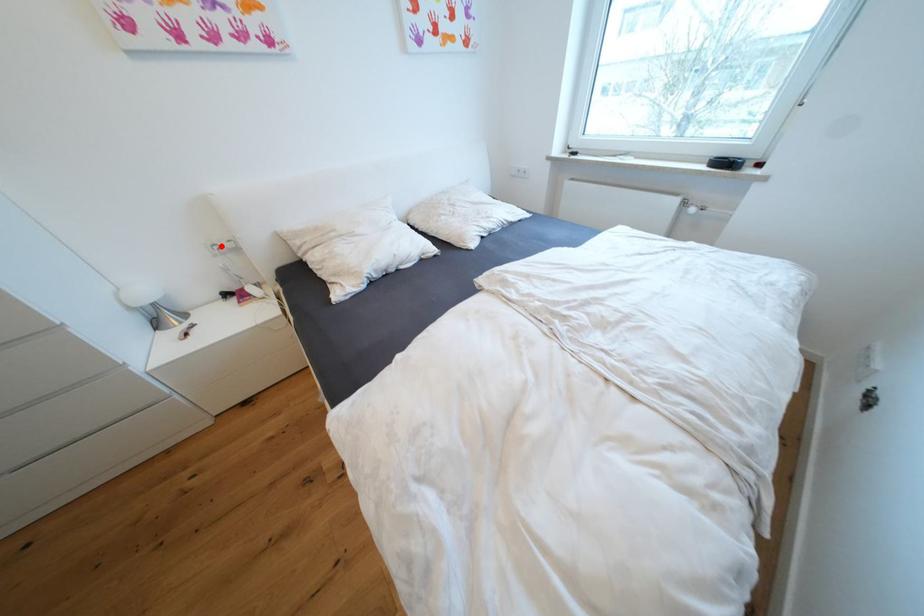
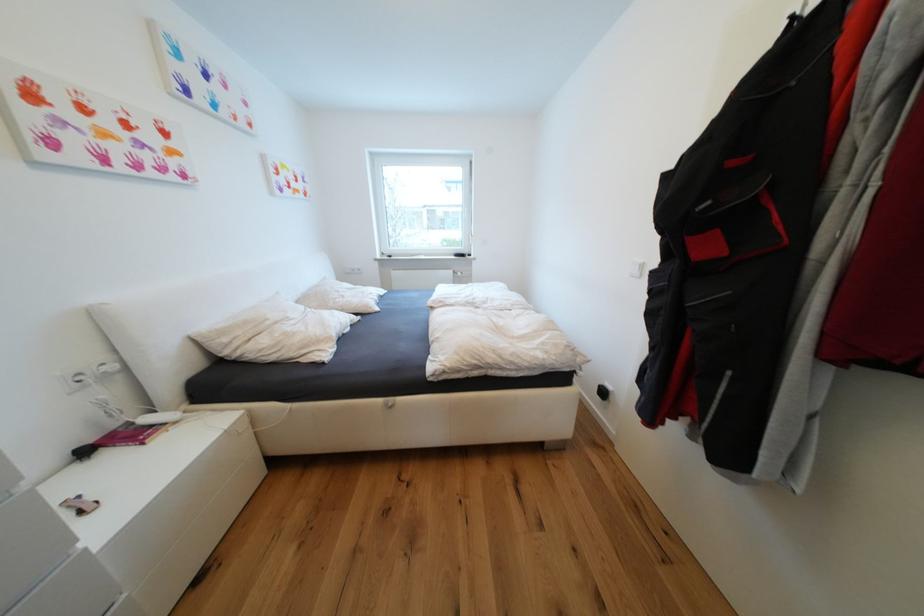
Question: A red point is marked in image1. In image2, is the corresponding 3D point closer to the camera or farther? Reply with the corresponding letter.

Choices:
 (A) The corresponding 3D point is closer.
 (B) The corresponding 3D point is farther.

Answer: (B)